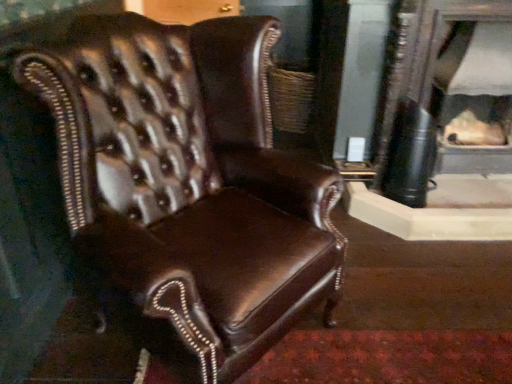
Question: Are brown leather chair at center and matte black fireplace at center located far from each other?

Choices:
 (A) yes
 (B) no

Answer: (A)

Question: From the image's perspective, would you say brown leather chair at center is shown under matte black fireplace at center?

Choices:
 (A) yes
 (B) no

Answer: (A)

Question: Is brown leather chair at center to the right of matte black fireplace at center from the viewer's perspective?

Choices:
 (A) no
 (B) yes

Answer: (A)

Question: Is brown leather chair at center at the left side of matte black fireplace at center?

Choices:
 (A) yes
 (B) no

Answer: (A)

Question: Considering the relative sizes of brown leather chair at center and matte black fireplace at center in the image provided, is brown leather chair at center taller than matte black fireplace at center?

Choices:
 (A) no
 (B) yes

Answer: (B)

Question: Does brown leather chair at center have a larger size compared to matte black fireplace at center?

Choices:
 (A) yes
 (B) no

Answer: (A)

Question: Is matte black fireplace at center touching brown leather chair at center?

Choices:
 (A) no
 (B) yes

Answer: (A)

Question: Can you confirm if matte black fireplace at center is shorter than brown leather chair at center?

Choices:
 (A) yes
 (B) no

Answer: (A)

Question: Considering the relative positions of matte black fireplace at center and brown leather chair at center in the image provided, is matte black fireplace at center to the right of brown leather chair at center from the viewer's perspective?

Choices:
 (A) yes
 (B) no

Answer: (A)

Question: Is matte black fireplace at center smaller than brown leather chair at center?

Choices:
 (A) no
 (B) yes

Answer: (B)

Question: From the image's perspective, does matte black fireplace at center appear higher than brown leather chair at center?

Choices:
 (A) no
 (B) yes

Answer: (B)

Question: Does matte black fireplace at center have a lesser width compared to brown leather chair at center?

Choices:
 (A) no
 (B) yes

Answer: (B)

Question: Considering the positions of point (403, 31) and point (324, 276), is point (403, 31) closer or farther from the camera than point (324, 276)?

Choices:
 (A) closer
 (B) farther

Answer: (B)